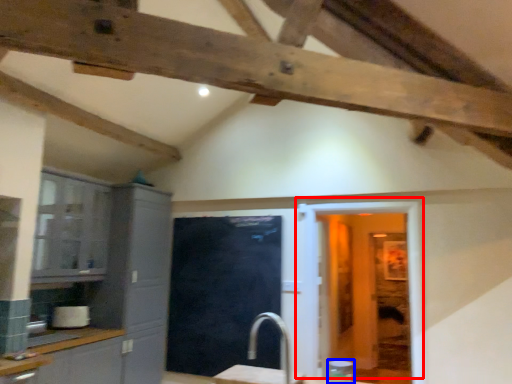
Question: Which object is further to the camera taking this photo, door (highlighted by a red box) or appliance (highlighted by a blue box)?

Choices:
 (A) door
 (B) appliance

Answer: (A)